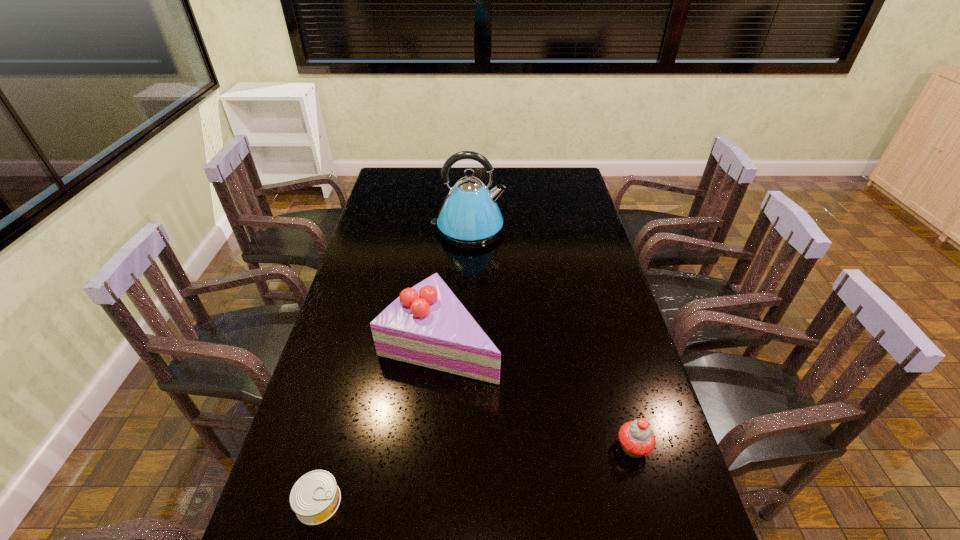
Image resolution: width=960 pixels, height=540 pixels. What are the coordinates of `vacant region that satisfies the following two spatial constraints: 1. at the spout of the farthest object; 2. on the left side of the third farthest object` in the screenshot? It's located at (460, 447).

Where is `vacant space that satisfies the following two spatial constraints: 1. at the spout of the rightmost object; 2. on the left side of the kettle`? vacant space that satisfies the following two spatial constraints: 1. at the spout of the rightmost object; 2. on the left side of the kettle is located at coordinates (460, 447).

What are the coordinates of `vacant position in the image that satisfies the following two spatial constraints: 1. at the spout of the second shortest object; 2. on the left side of the farthest object` in the screenshot? It's located at (460, 447).

You are a GUI agent. You are given a task and a screenshot of the screen. Output one action in this format:
    pyautogui.click(x=<x>, y=<y>)
    Task: Click on the vacant space that satisfies the following two spatial constraints: 1. on the front side of the second farthest object; 2. on the right side of the cupcake
    The height and width of the screenshot is (540, 960).
    Given the screenshot: What is the action you would take?
    [429, 447]